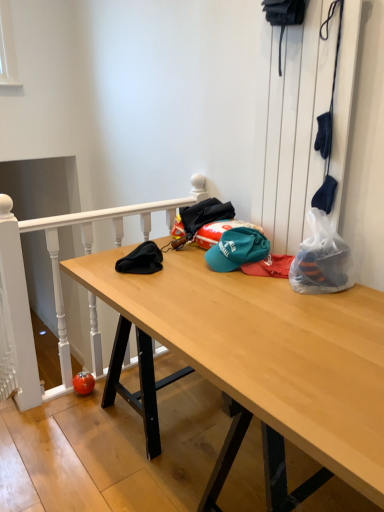
Question: Does teal fabric cap at center have a lesser height compared to light wood desk at center?

Choices:
 (A) no
 (B) yes

Answer: (A)

Question: From the image's perspective, is teal fabric cap at center beneath light wood desk at center?

Choices:
 (A) yes
 (B) no

Answer: (B)

Question: Can you confirm if teal fabric cap at center is taller than light wood desk at center?

Choices:
 (A) yes
 (B) no

Answer: (A)

Question: From the image's perspective, is teal fabric cap at center over light wood desk at center?

Choices:
 (A) no
 (B) yes

Answer: (B)

Question: Does teal fabric cap at center have a greater width compared to light wood desk at center?

Choices:
 (A) yes
 (B) no

Answer: (B)

Question: In terms of size, does white wood rail at upper left appear bigger or smaller than translucent plastic bag at right?

Choices:
 (A) small
 (B) big

Answer: (B)

Question: Is point (92, 302) closer or farther from the camera than point (345, 287)?

Choices:
 (A) closer
 (B) farther

Answer: (B)

Question: In terms of height, does white wood rail at upper left look taller or shorter compared to translucent plastic bag at right?

Choices:
 (A) tall
 (B) short

Answer: (A)

Question: Is white wood rail at upper left inside or outside of translucent plastic bag at right?

Choices:
 (A) outside
 (B) inside

Answer: (A)

Question: Would you say translucent plastic bag at right is inside or outside teal fabric cap at center?

Choices:
 (A) outside
 (B) inside

Answer: (A)

Question: From the image's perspective, is translucent plastic bag at right above or below teal fabric cap at center?

Choices:
 (A) below
 (B) above

Answer: (A)

Question: From a real-world perspective, is translucent plastic bag at right above or below teal fabric cap at center?

Choices:
 (A) above
 (B) below

Answer: (A)

Question: In the image, is translucent plastic bag at right on the left side or the right side of teal fabric cap at center?

Choices:
 (A) right
 (B) left

Answer: (A)

Question: Is light wood desk at center taller or shorter than translucent plastic bag at right?

Choices:
 (A) tall
 (B) short

Answer: (B)

Question: Which is correct: light wood desk at center is inside translucent plastic bag at right, or outside of it?

Choices:
 (A) inside
 (B) outside

Answer: (B)